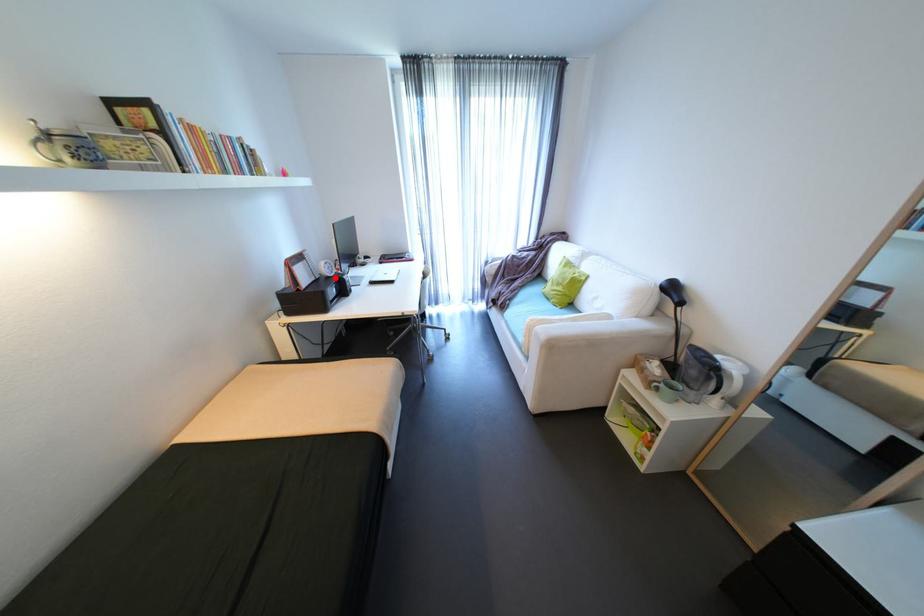
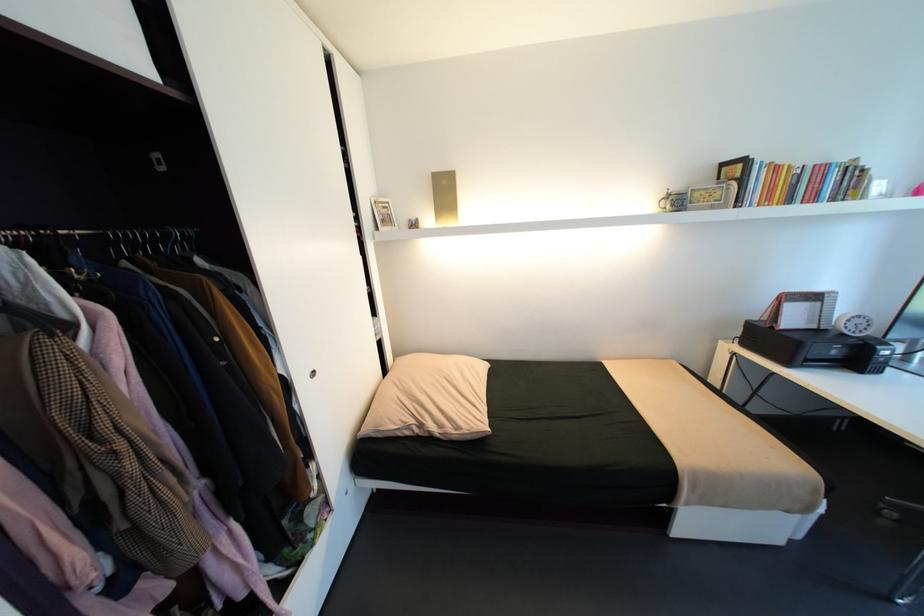
Locate, in the second image, the point that corresponds to the highlighted location in the first image.

(850, 334)